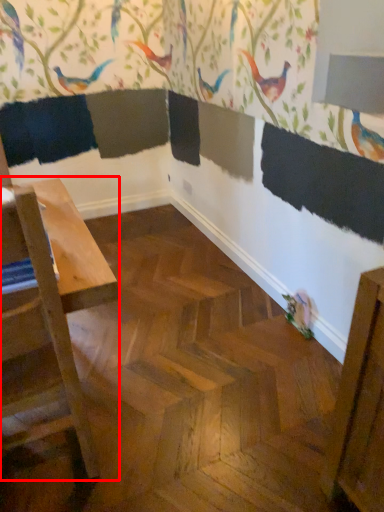
Question: From the image's perspective, what is the correct spatial relationship of table (annotated by the red box) in relation to bird?

Choices:
 (A) above
 (B) below

Answer: (A)